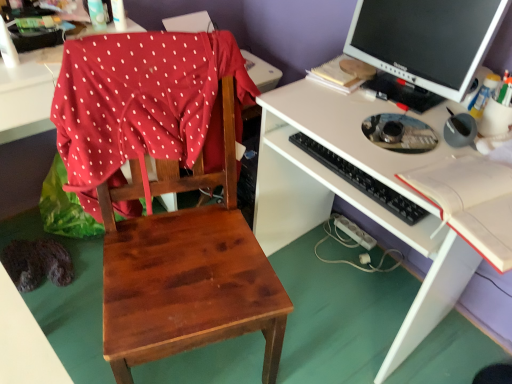
Question: From a real-world perspective, is white plastic bottle at upper center, the 2th bottle in the left-to-right sequence, physically above clear plastic bottle at upper left, marked as the third bottle in a bottom-to-top arrangement?

Choices:
 (A) yes
 (B) no

Answer: (B)

Question: Does white plastic bottle at upper center, the second bottle positioned from the bottom, have a larger size compared to clear plastic bottle at upper left, the first bottle viewed from the left?

Choices:
 (A) no
 (B) yes

Answer: (A)

Question: Is white plastic bottle at upper center, the 2th bottle in the left-to-right sequence, at the left side of clear plastic bottle at upper left, the third bottle from the right?

Choices:
 (A) yes
 (B) no

Answer: (B)

Question: Does white plastic bottle at upper center, the 2th bottle in the left-to-right sequence, have a lesser width compared to clear plastic bottle at upper left, marked as the third bottle in a bottom-to-top arrangement?

Choices:
 (A) yes
 (B) no

Answer: (B)

Question: Is white plastic bottle at upper center, which ranks as the 2th bottle in top-to-bottom order, closer to camera compared to clear plastic bottle at upper left, marked as the third bottle in a bottom-to-top arrangement?

Choices:
 (A) no
 (B) yes

Answer: (A)

Question: From the image's perspective, is white plastic bottle at upper center, the second bottle from the right, on clear plastic bottle at upper left, the third bottle from the right?

Choices:
 (A) no
 (B) yes

Answer: (A)

Question: Considering the relative sizes of translucent plastic bottle at upper right, the 1th bottle when ordered from right to left, and clear plastic bottle at upper left, the first bottle viewed from the left, in the image provided, is translucent plastic bottle at upper right, the 1th bottle when ordered from right to left, thinner than clear plastic bottle at upper left, the first bottle viewed from the left,?

Choices:
 (A) yes
 (B) no

Answer: (B)

Question: Does translucent plastic bottle at upper right, the 1th bottle when ordered from right to left, have a larger size compared to clear plastic bottle at upper left, the 1th bottle positioned from the top?

Choices:
 (A) yes
 (B) no

Answer: (B)

Question: From the image's perspective, is translucent plastic bottle at upper right, acting as the 3th bottle starting from the left, below clear plastic bottle at upper left, the 1th bottle positioned from the top?

Choices:
 (A) no
 (B) yes

Answer: (B)

Question: Is translucent plastic bottle at upper right, which is the 1th bottle from bottom to top, turned away from clear plastic bottle at upper left, marked as the third bottle in a bottom-to-top arrangement?

Choices:
 (A) no
 (B) yes

Answer: (A)

Question: Is translucent plastic bottle at upper right, the 1th bottle when ordered from right to left, wider than clear plastic bottle at upper left, the first bottle viewed from the left?

Choices:
 (A) yes
 (B) no

Answer: (A)

Question: From a real-world perspective, does translucent plastic bottle at upper right, acting as the 3th bottle starting from the left, sit lower than clear plastic bottle at upper left, the third bottle from the right?

Choices:
 (A) no
 (B) yes

Answer: (B)

Question: Can you confirm if black plastic keyboard at center is bigger than matte black monitor at upper right?

Choices:
 (A) no
 (B) yes

Answer: (A)